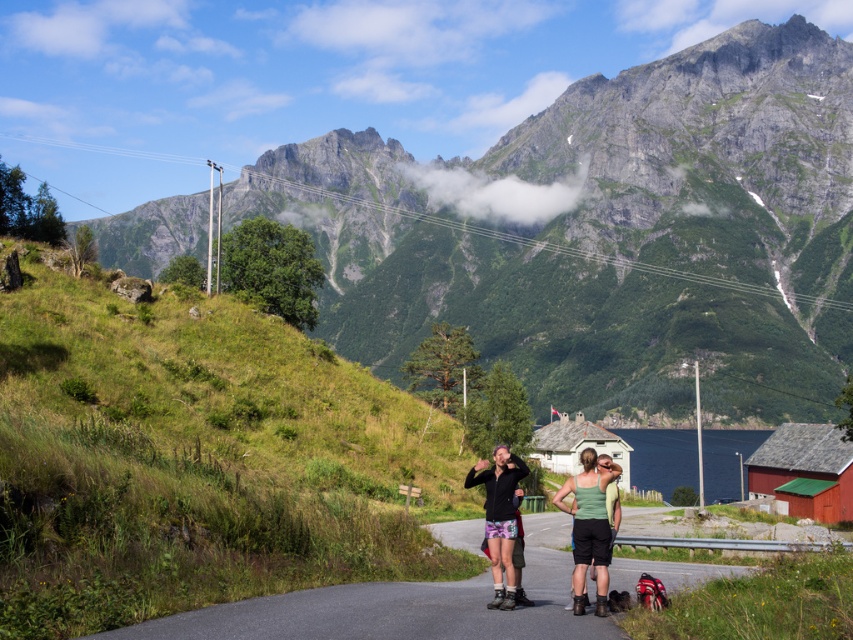
You are standing at the starting point and want to reach the gray rocky mountain at upper center. Given that the mountain is located at coordinates approximately 0.366 on the x and 0.717 on the y axis, can you estimate if you are closer to the mountain horizontally or vertically?

The gray rocky mountain at upper center is located at coordinates approximately 0.366 on the x and 0.717 on the y axis. Since the x and y coordinates are both less than 1, it means the mountain is positioned to the right and above your current position. To determine if you are closer horizontally or vertically, calculate the distance. The horizontal distance is 0.366 units, and the vertical distance is 0.717 units. Since 0.366 is less than 0.717, you are closer horizontally than vertically.

You are standing at the mountain road and want to take a photo. There are two points marked in the scene, point (339, 232) and point (473, 467). Which point is closer to your camera when taking the photo?

Point (473, 467) is closer to the camera than point (339, 232) because the description states that point (339, 232) is further to the camera than point (473, 467).